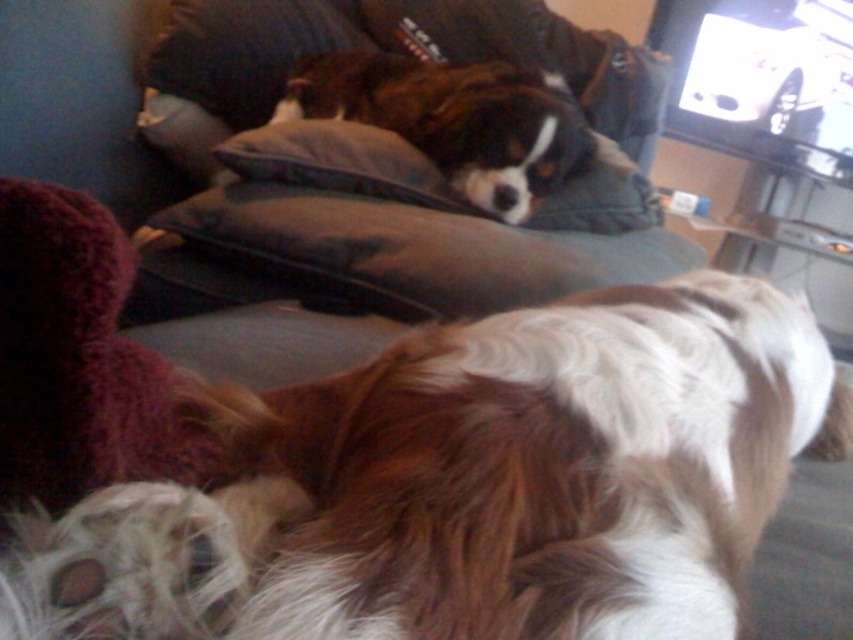
Between brown and white fur at center and dark gray cushion at center, which one appears on the left side from the viewer's perspective?

dark gray cushion at center

Does brown and white fur at center have a smaller size compared to dark gray cushion at center?

Actually, brown and white fur at center might be larger than dark gray cushion at center.

The width and height of the screenshot is (853, 640). What are the coordinates of `brown and white fur at center` in the screenshot? It's located at (465, 484).

Where is `brown and white fur at center`? The height and width of the screenshot is (640, 853). brown and white fur at center is located at coordinates (465, 484).

Can you confirm if brown and white fur at center is bigger than brown fur dog at center?

Incorrect, brown and white fur at center is not larger than brown fur dog at center.

Can you confirm if brown and white fur at center is smaller than brown fur dog at center?

Yes, brown and white fur at center is smaller than brown fur dog at center.

The width and height of the screenshot is (853, 640). Find the location of `brown and white fur at center`. brown and white fur at center is located at coordinates (465, 484).

The width and height of the screenshot is (853, 640). In order to click on brown and white fur at center in this screenshot , I will do `click(465, 484)`.

Which is behind, point (601, 483) or point (164, 49)?

The point (164, 49) is behind.

The height and width of the screenshot is (640, 853). Identify the location of brown and white fur at center. (465, 484).